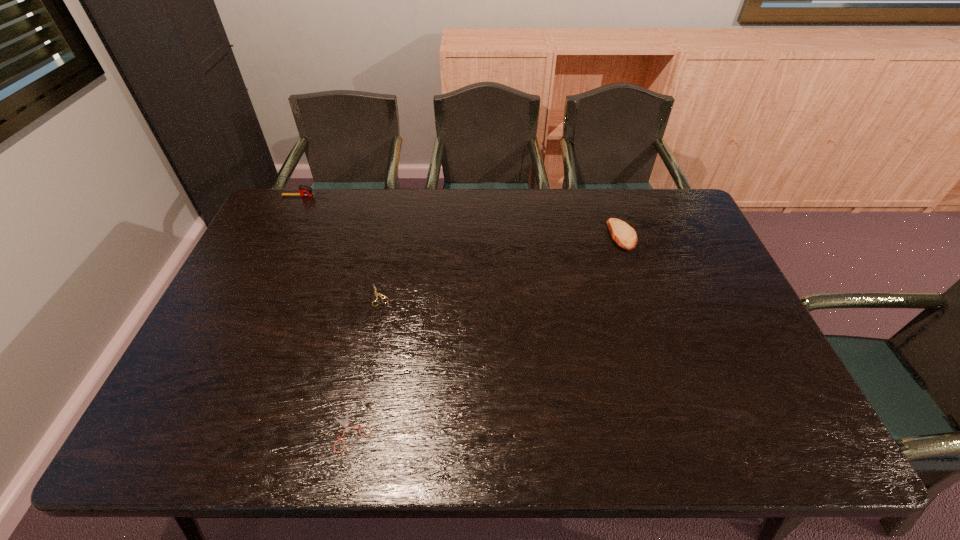
Identify the location of the leftmost object. (305, 190).

Where is `tape measure`? The height and width of the screenshot is (540, 960). tape measure is located at coordinates (305, 190).

Where is `pita bread`? The width and height of the screenshot is (960, 540). pita bread is located at coordinates (624, 235).

Locate an element on the screen. the third shortest object is located at coordinates (624, 235).

In order to click on the taller shears in this screenshot , I will do `click(380, 295)`.

The height and width of the screenshot is (540, 960). In order to click on the third tallest object in this screenshot , I will do `click(380, 295)`.

The image size is (960, 540). In order to click on the nearest object in this screenshot , I will do `click(346, 423)`.

Locate an element on the screen. the nearer shears is located at coordinates (346, 423).

I want to click on vacant position located on the right of the tape measure, so click(433, 196).

Find the location of a particular element. The image size is (960, 540). vacant region located on the front of the pita bread is located at coordinates (634, 267).